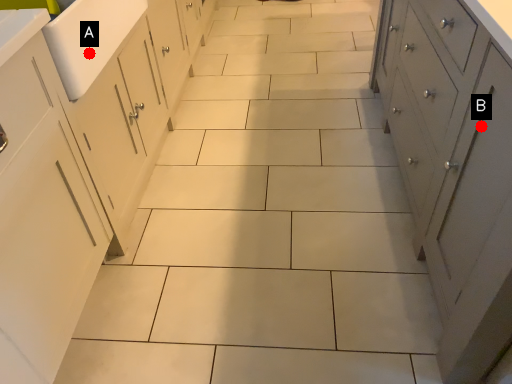
Question: Two points are circled on the image, labeled by A and B beside each circle. Which point appears farthest from the camera in this image?

Choices:
 (A) A is further
 (B) B is further

Answer: (A)